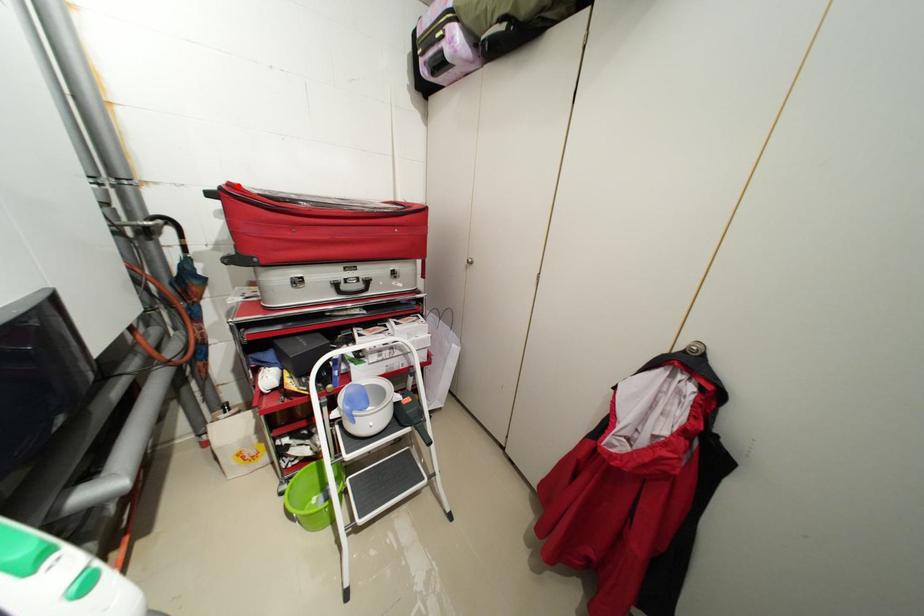
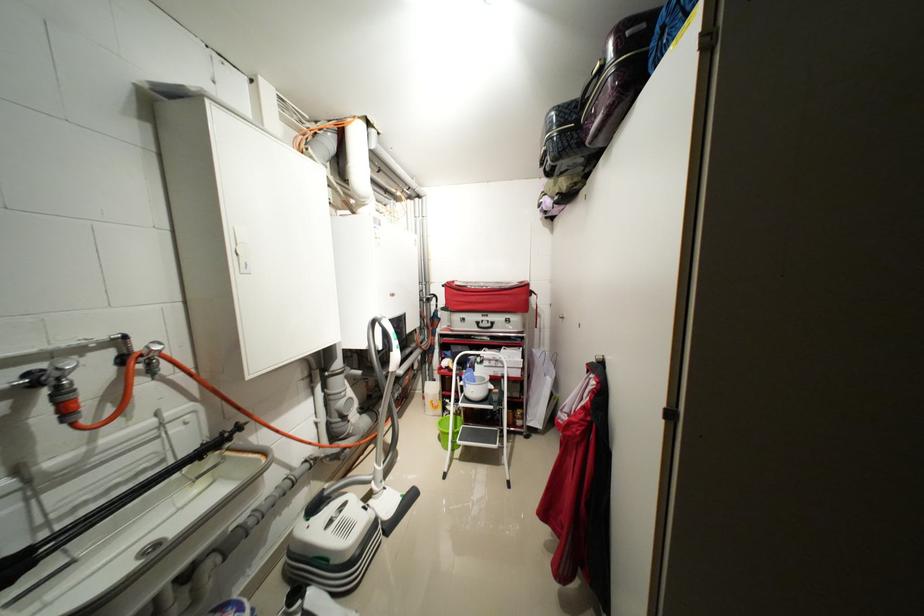
Find the pixel in the second image that matches the highlighted location in the first image.

(455, 284)